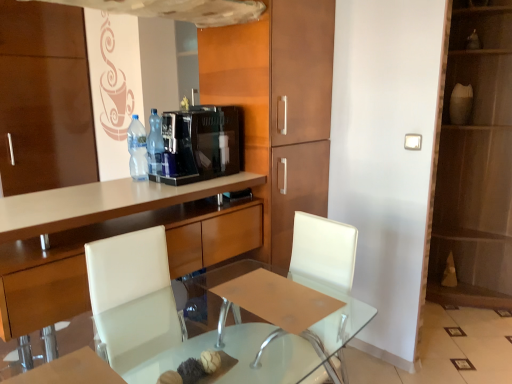
Question: Is wooden cabinet at center, which ranks as the 1th cabinetry in right-to-left order, in front of or behind white leather armchair at center in the image?

Choices:
 (A) behind
 (B) front

Answer: (A)

Question: In terms of height, does wooden cabinet at center, which ranks as the 1th cabinetry in right-to-left order, look taller or shorter compared to white leather armchair at center?

Choices:
 (A) tall
 (B) short

Answer: (A)

Question: Estimate the real-world distances between objects in this image. Which object is closer to the transparent glass table at center?

Choices:
 (A) white leather armchair at center
 (B) black glossy coffee machine at center
 (C) wooden cabinet at center, the 2th cabinetry when ordered from left to right
 (D) clear plastic bottle at center, which is the second bottle from right to left
 (E) matte brown dresser at right

Answer: (A)

Question: Which object is positioned closest to the transparent glass table at center?

Choices:
 (A) translucent plastic bottle at center, which is the first bottle from right to left
 (B) clear plastic bottle at center, the 1th bottle in the left-to-right sequence
 (C) matte brown dresser at right
 (D) white leather armchair at center
 (E) wooden cabinet at center, the 2th cabinetry when ordered from left to right

Answer: (D)